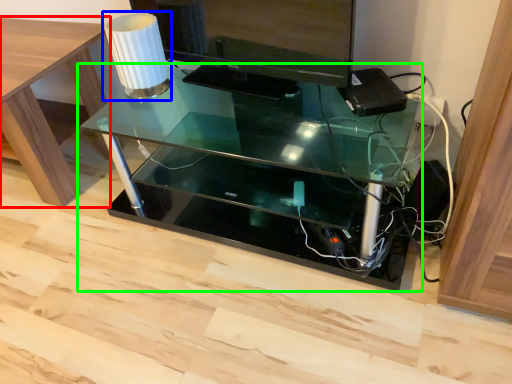
Question: Which is nearer to the table (highlighted by a red box)? table lamp (highlighted by a blue box) or table (highlighted by a green box).

Choices:
 (A) table lamp
 (B) table

Answer: (A)